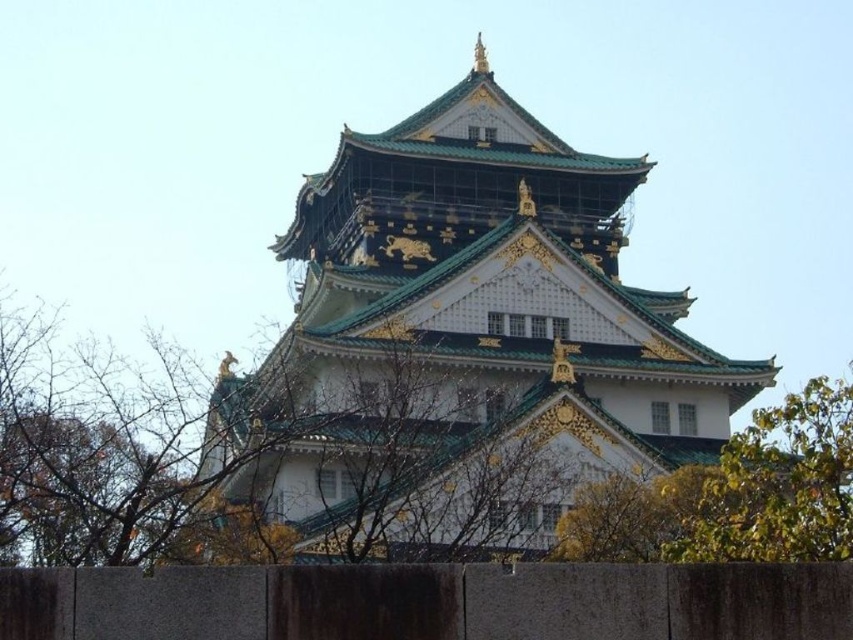
You are standing in front of a traditional Japanese building and notice a specific point marked at coordinates (462, 344). Based on the scene description, which architectural feature does this point most likely represent?

The point at (462, 344) corresponds to the green matte tower at center.

You are standing in front of the traditional Japanese building and notice two green elements at the center. Which one is positioned higher up, the green matte tower at center or the green leafy tree at center?

The green matte tower at center is located above the green leafy tree at center, so it is positioned higher up.

You are standing at the entrance of the traditional Japanese building and want to locate the green matte tower at center. According to the coordinates provided, where should you look to find it?

The green matte tower at center is located at coordinates point (462, 344).